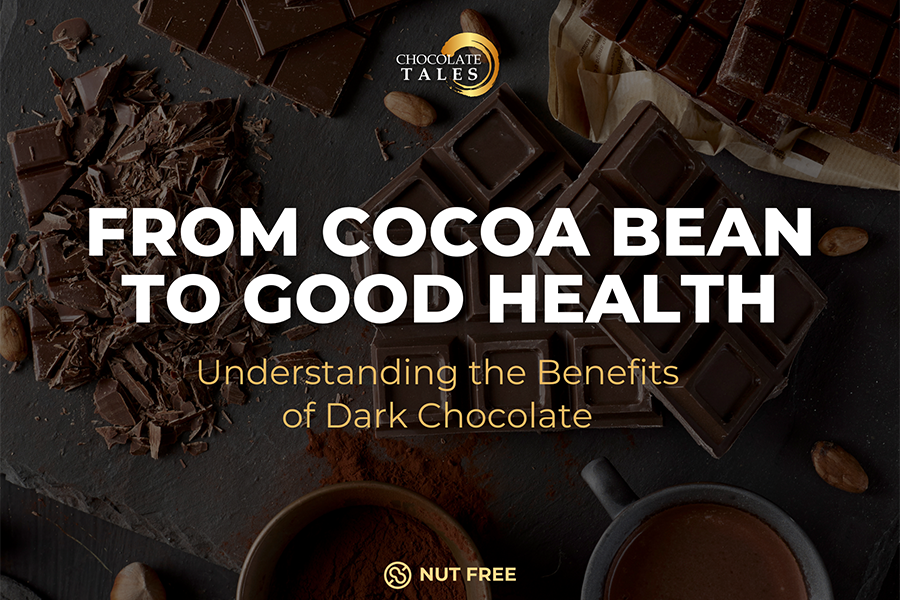
This screenshot has width=900, height=600. I want to click on table for the product, so click(244, 497).